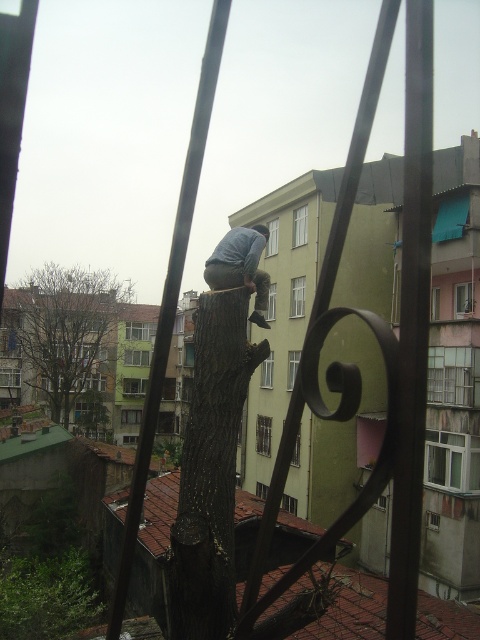
You are a delivery person trying to deliver a package to the person wearing light blue denim jeans at center. The package requires a stable surface to place it. Considering the brown rough tree trunk at center, can you place the package on top of it?

The brown rough tree trunk at center might be wider than light blue denim jeans at center, so it could provide a stable surface to place the package.